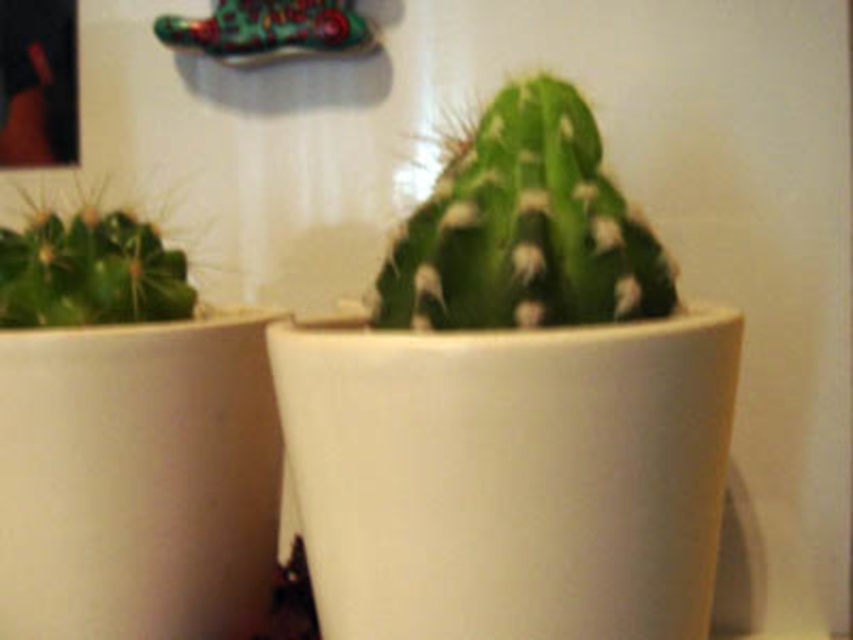
You are arranging plants on a shelf and see the green matte cactus at center and the green matte cactus at left. Which one is positioned higher up on the shelf?

The green matte cactus at center is positioned higher up on the shelf than the green matte cactus at left.

You are arranging plants in a living room and need to place the green matte cactus at center and the green matte cactus at left on a shelf. The shelf has a height limit of 30 cm. If the taller cactus is 35 cm tall, will both fit on the shelf?

The green matte cactus at center is taller than the green matte cactus at left. Since the taller cactus is 35 cm and the shelf has a 30 cm height limit, the green matte cactus at center will not fit on the shelf. The smaller cactus might fit, but the taller one exceeds the height restriction.

You are a delivery robot with a package that needs to be placed exactly 20 inches away from the green matte cactus at center. Can you place the package at your current position?

The green matte cactus at center and viewer are 19.05 inches apart. Since the required distance is 20 inches, you need to move 0.95 inches further away from the green matte cactus at center to place the package correctly.